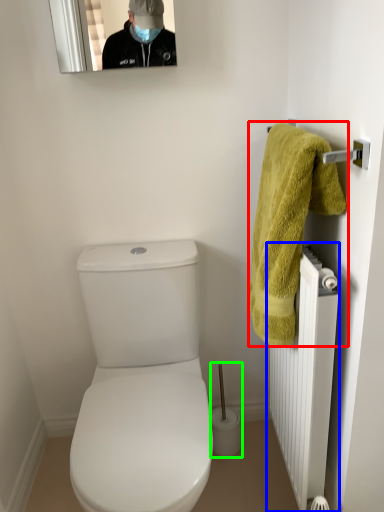
Question: Which object is the farthest from towel (highlighted by a red box)? Choose among these: radiator (highlighted by a blue box) or brush (highlighted by a green box).

Choices:
 (A) radiator
 (B) brush

Answer: (B)